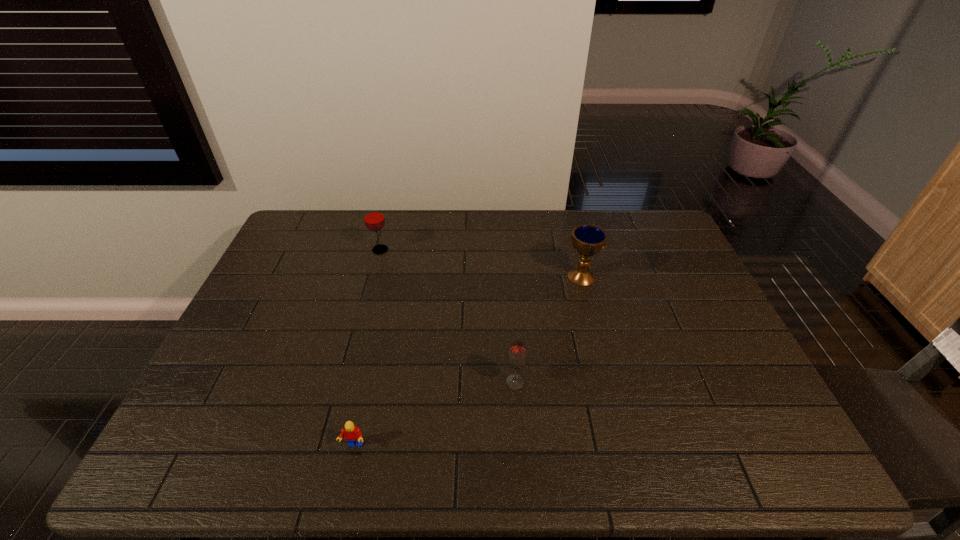
Locate an element on the screen. Image resolution: width=960 pixels, height=540 pixels. the farther glass drink container is located at coordinates (374, 219).

Locate an element on the screen. This screenshot has height=540, width=960. the farthest object is located at coordinates (374, 219).

Where is `the rightmost object`? Image resolution: width=960 pixels, height=540 pixels. the rightmost object is located at coordinates (588, 240).

Identify the location of the second farthest object. Image resolution: width=960 pixels, height=540 pixels. (588, 240).

Locate an element on the screen. The width and height of the screenshot is (960, 540). the second object from right to left is located at coordinates (517, 356).

This screenshot has height=540, width=960. I want to click on the right glass drink container, so click(517, 356).

The width and height of the screenshot is (960, 540). What are the coordinates of `the shortest object` in the screenshot? It's located at (352, 433).

Image resolution: width=960 pixels, height=540 pixels. In order to click on the nearest object in this screenshot , I will do `click(352, 433)`.

Identify the location of free space located 0.160m on the right of the left glass drink container. The image size is (960, 540). (437, 250).

Identify the location of vacant space located on the back of the chalice. This screenshot has height=540, width=960. (570, 233).